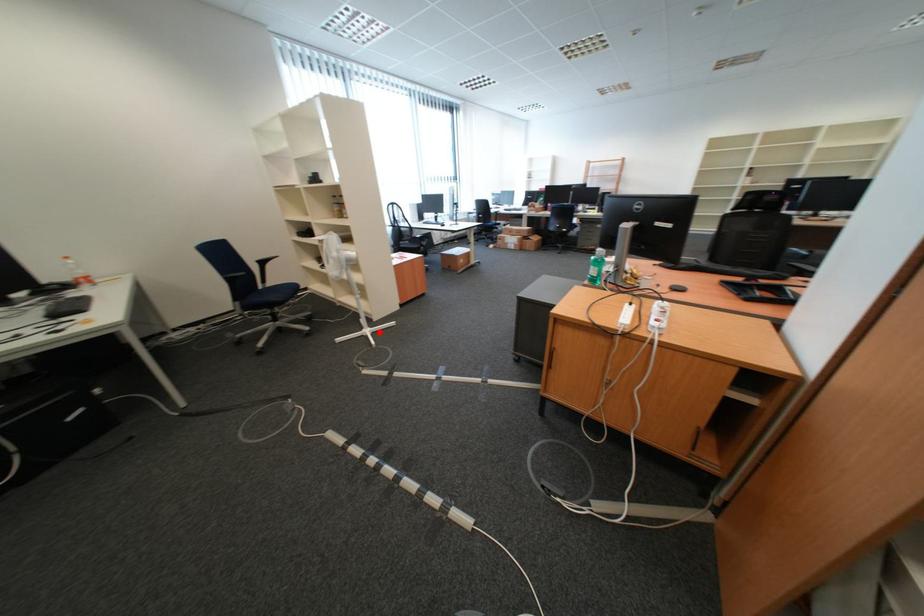
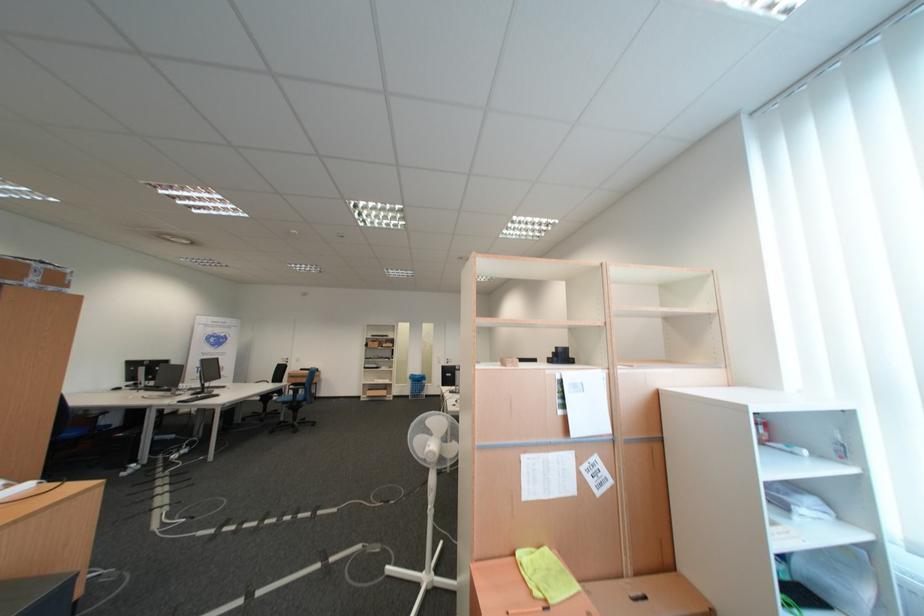
Question: A red point is marked in image1. In image2, is the corresponding 3D point closer to the camera or farther? Reply with the corresponding letter.

Choices:
 (A) The corresponding 3D point is closer.
 (B) The corresponding 3D point is farther.

Answer: (B)